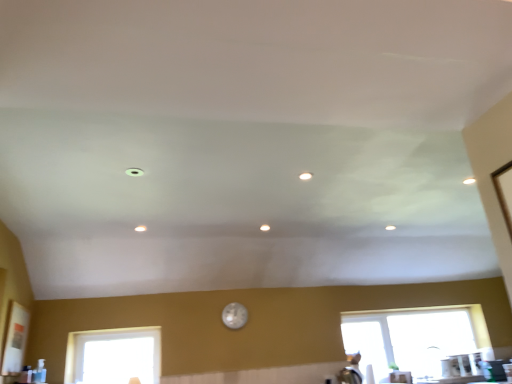
Question: From a real-world perspective, does transparent glass window at lower right, which is the second window from front to back, sit lower than transparent glass window at lower left, which appears as the first window when viewed from the left?

Choices:
 (A) no
 (B) yes

Answer: (B)

Question: Considering the relative positions of transparent glass window at lower right, the first window in the back-to-front sequence, and transparent glass window at lower left, the second window in the right-to-left sequence, in the image provided, is transparent glass window at lower right, the first window in the back-to-front sequence, to the left of transparent glass window at lower left, the second window in the right-to-left sequence, from the viewer's perspective?

Choices:
 (A) yes
 (B) no

Answer: (B)

Question: Is transparent glass window at lower left, the second window in the right-to-left sequence, located within transparent glass window at lower right, which is the second window from front to back?

Choices:
 (A) yes
 (B) no

Answer: (B)

Question: Is transparent glass window at lower right, the first window in the back-to-front sequence, next to transparent glass window at lower left, which is the 2th window from back to front?

Choices:
 (A) yes
 (B) no

Answer: (B)

Question: From the image's perspective, would you say transparent glass window at lower right, positioned as the first window in right-to-left order, is positioned over transparent glass window at lower left, the first window when ordered from front to back?

Choices:
 (A) no
 (B) yes

Answer: (A)

Question: Visually, is transparent glass window at lower right, positioned as the first window in right-to-left order, positioned to the left or to the right of pearl-like glass clock at center?

Choices:
 (A) right
 (B) left

Answer: (A)

Question: Is point (403, 311) positioned closer to the camera than point (243, 304)?

Choices:
 (A) closer
 (B) farther

Answer: (B)

Question: Considering the positions of transparent glass window at lower right, the first window in the back-to-front sequence, and pearl-like glass clock at center in the image, is transparent glass window at lower right, the first window in the back-to-front sequence, wider or thinner than pearl-like glass clock at center?

Choices:
 (A) thin
 (B) wide

Answer: (B)

Question: Is transparent glass window at lower right, the first window in the back-to-front sequence, inside or outside of pearl-like glass clock at center?

Choices:
 (A) outside
 (B) inside

Answer: (A)

Question: Looking at the image, does transparent glass window at lower left, the first window when ordered from front to back, seem bigger or smaller compared to pearl-like glass clock at center?

Choices:
 (A) small
 (B) big

Answer: (B)

Question: From the image's perspective, relative to pearl-like glass clock at center, is transparent glass window at lower left, the first window when ordered from front to back, above or below?

Choices:
 (A) above
 (B) below

Answer: (B)

Question: Is point (143, 372) positioned closer to the camera than point (243, 311)?

Choices:
 (A) farther
 (B) closer

Answer: (B)

Question: From a real-world perspective, is transparent glass window at lower left, which appears as the first window when viewed from the left, physically located above or below pearl-like glass clock at center?

Choices:
 (A) below
 (B) above

Answer: (A)

Question: Considering their positions, is transparent glass window at lower left, which appears as the first window when viewed from the left, located in front of or behind transparent glass window at lower right, which is the second window from front to back?

Choices:
 (A) front
 (B) behind

Answer: (A)

Question: From the image's perspective, is transparent glass window at lower left, which is the 2th window from back to front, positioned above or below transparent glass window at lower right, positioned as the first window in right-to-left order?

Choices:
 (A) above
 (B) below

Answer: (A)